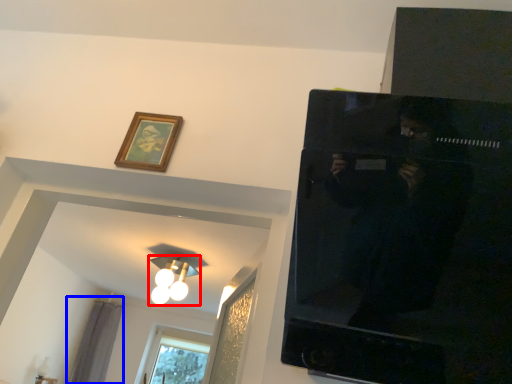
Question: Among these objects, which one is nearest to the camera, light fixture (highlighted by a red box) or curtain (highlighted by a blue box)?

Choices:
 (A) light fixture
 (B) curtain

Answer: (A)